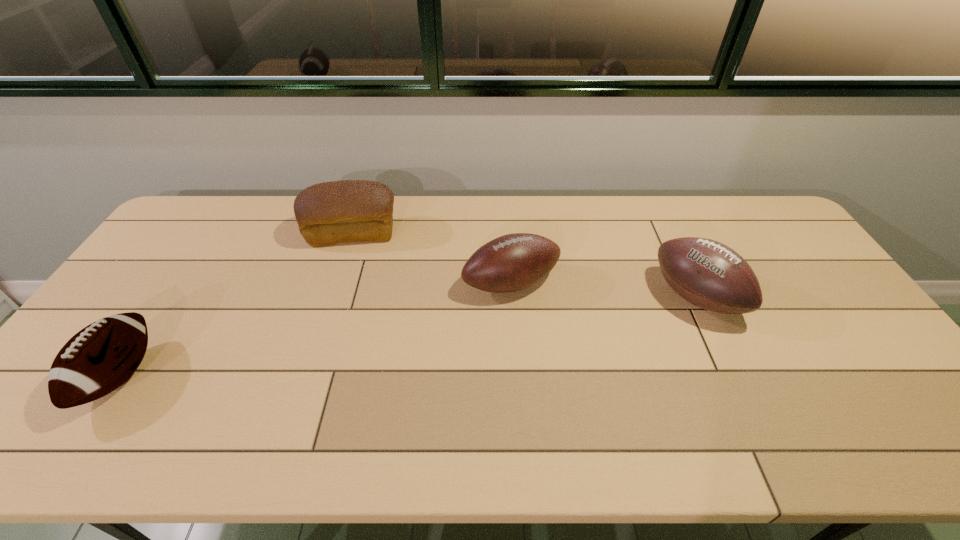
This screenshot has width=960, height=540. I want to click on object present at the far edge, so click(x=329, y=213).

The image size is (960, 540). I want to click on object positioned at the near edge, so click(x=101, y=357).

Where is `object that is at the left edge`? Image resolution: width=960 pixels, height=540 pixels. object that is at the left edge is located at coordinates (101, 357).

At what (x,y) coordinates should I click in order to perform the action: click on object that is at the near left corner. Please return your answer as a coordinate pair (x, y). The height and width of the screenshot is (540, 960). Looking at the image, I should click on (101, 357).

Image resolution: width=960 pixels, height=540 pixels. Identify the location of blank space at the far edge. (669, 209).

Where is `free space at the near edge of the desktop`? free space at the near edge of the desktop is located at coordinates (661, 422).

In the image, there is a desktop. At what (x,y) coordinates should I click in order to perform the action: click on vacant space at the left edge. Please return your answer as a coordinate pair (x, y). Looking at the image, I should click on (86, 404).

Image resolution: width=960 pixels, height=540 pixels. What are the coordinates of `vacant space at the right edge of the desktop` in the screenshot? It's located at (904, 408).

Image resolution: width=960 pixels, height=540 pixels. In the image, there is a desktop. In order to click on free space at the far right corner in this screenshot , I will do `click(735, 219)`.

The width and height of the screenshot is (960, 540). I want to click on vacant space that's between the third object from left to right and the bread, so click(x=432, y=258).